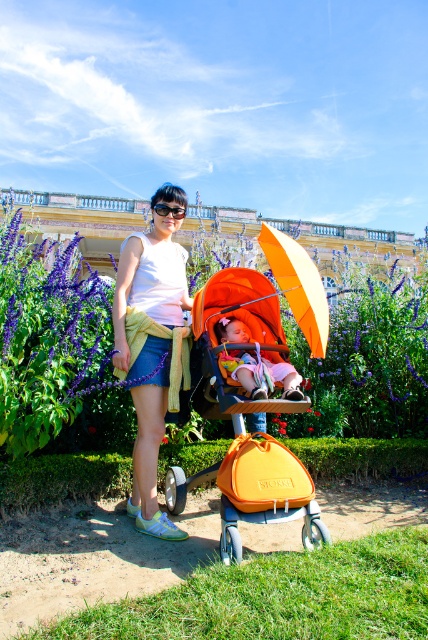
You are a fashion designer observing this scene. You need to determine which item is shorter between the denim skirt at center and the orange matte umbrella at center. Which one is shorter?

The denim skirt at center is shorter than the orange matte umbrella at center.

You are a photographer standing at the orange matte baby carriage at center and want to take a photo of the purple matte flower at upper left. Given that your camera has a maximum focus range of 12 feet, will you be able to capture the flower clearly?

The purple matte flower at upper left is 12.40 feet away from the orange matte baby carriage at center. Since the camera can only focus up to 12 feet, the flower is slightly out of range and cannot be captured clearly.

You are a photographer standing at the position of the woman holding the stroller. You want to take a photo of the purple matte flower at upper left without moving the stroller. Can you fit both the stroller and the flower in the frame if your camera has a maximum field of view of 20 feet?

The distance between the stroller and the purple matte flower at upper left is 21.31 feet, which exceeds the camera field of view of 20 feet. Therefore, you cannot fit both the stroller and the flower in the frame without moving the stroller.